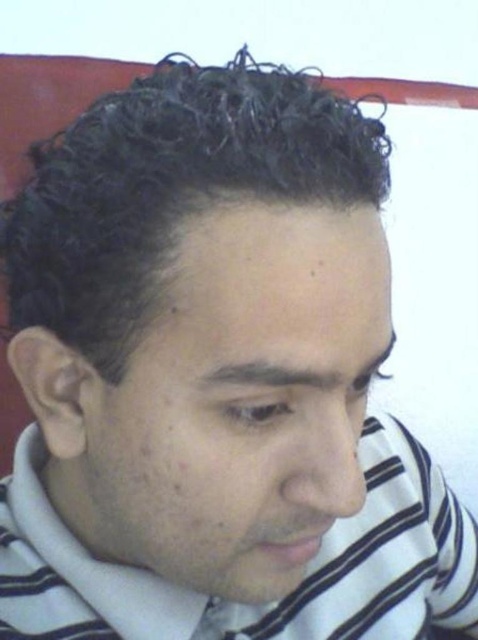
Which is above, curly black hair at upper center or white striped dress shirt at center?

curly black hair at upper center is above.

Is curly black hair at upper center wider than white striped dress shirt at center?

In fact, curly black hair at upper center might be narrower than white striped dress shirt at center.

Identify the location of curly black hair at upper center. (169, 188).

Identify the location of curly black hair at upper center. The height and width of the screenshot is (640, 478). (169, 188).